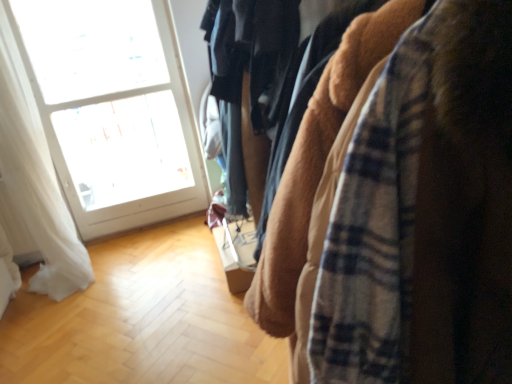
This screenshot has width=512, height=384. I want to click on vacant area situated below white glass window at upper left (from a real-world perspective), so click(141, 226).